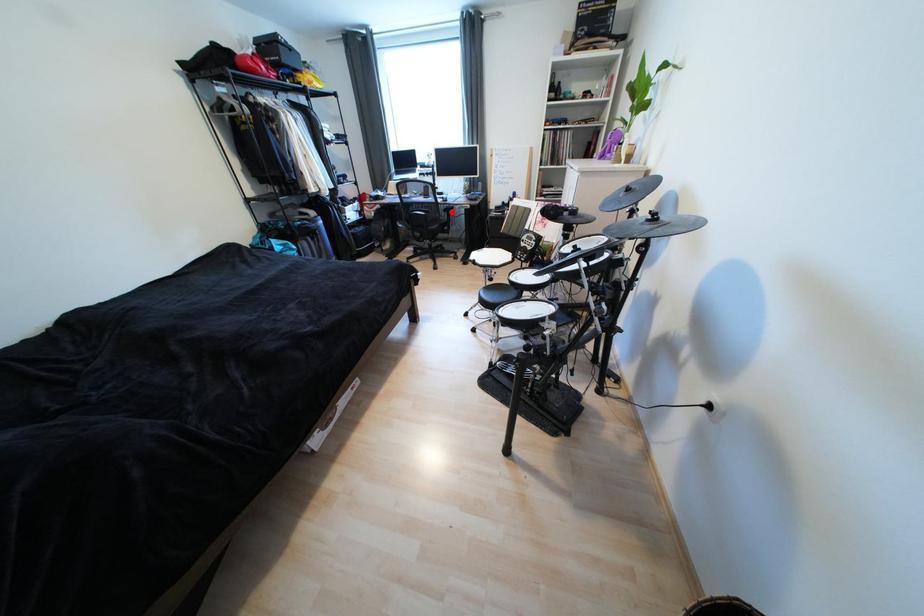
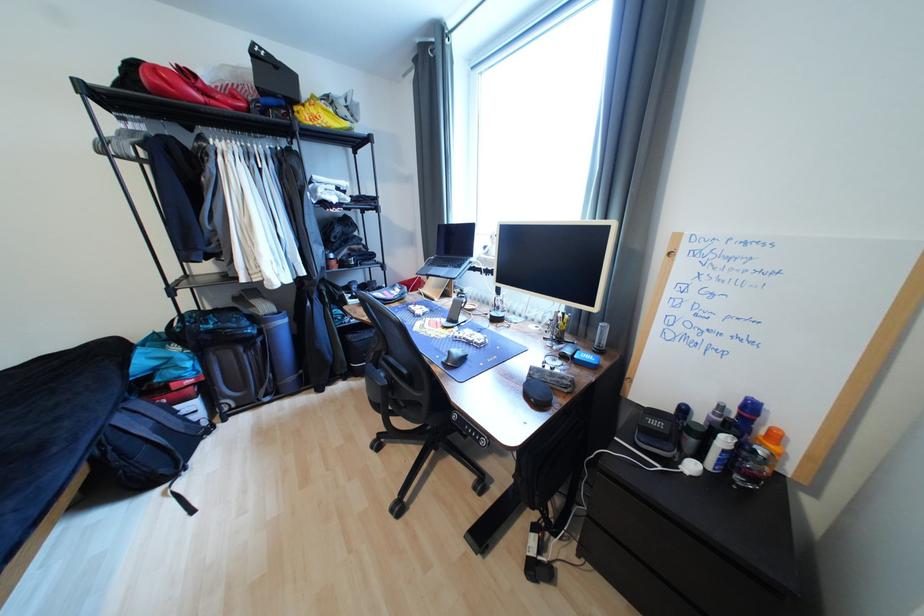
Question: I am providing you with two images of the same scene from different viewpoints. A red point is marked on the first image. Can you still see the location of the red point in image 2?

Choices:
 (A) Yes
 (B) No

Answer: (B)